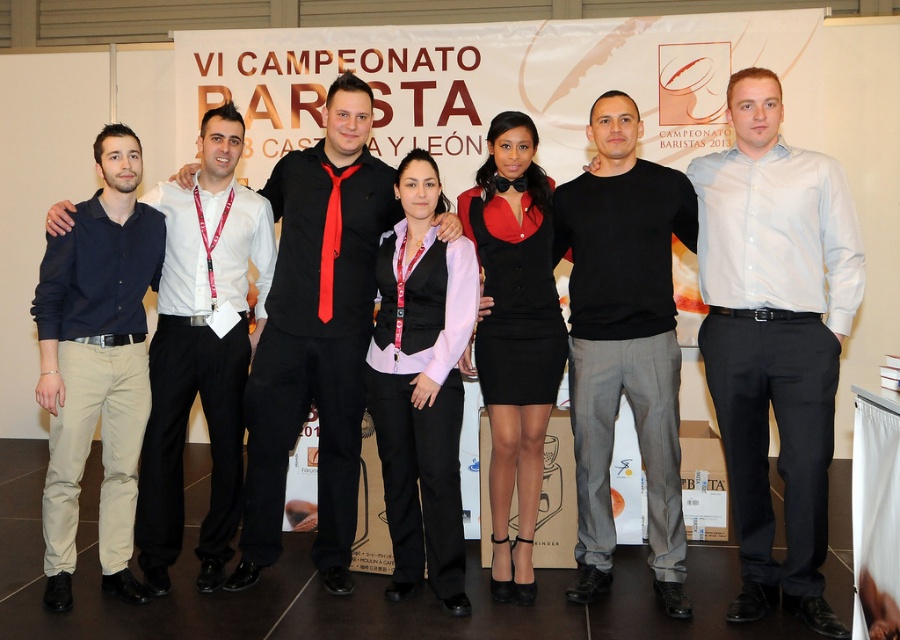
Can you confirm if light blue shirt at center is taller than matte black vest at center?

Indeed, light blue shirt at center has a greater height compared to matte black vest at center.

The width and height of the screenshot is (900, 640). Describe the element at coordinates (775, 339) in the screenshot. I see `light blue shirt at center` at that location.

The width and height of the screenshot is (900, 640). Identify the location of light blue shirt at center. (775, 339).

This screenshot has height=640, width=900. In order to click on light blue shirt at center in this screenshot , I will do `click(775, 339)`.

Can you confirm if black matte shirt at center is positioned to the left of black matte sweater at center?

Indeed, black matte shirt at center is positioned on the left side of black matte sweater at center.

Is black matte shirt at center wider than black matte sweater at center?

Indeed, black matte shirt at center has a greater width compared to black matte sweater at center.

Does point (345, 74) lie behind point (608, 284)?

Yes, point (345, 74) is farther from viewer.

The height and width of the screenshot is (640, 900). Find the location of `black matte shirt at center`. black matte shirt at center is located at coordinates (316, 333).

Can you confirm if light blue shirt at center is positioned below black matte shirt at center?

No.

Does light blue shirt at center have a larger size compared to black matte shirt at center?

Actually, light blue shirt at center might be smaller than black matte shirt at center.

Describe the element at coordinates (775, 339) in the screenshot. I see `light blue shirt at center` at that location.

Locate an element on the screen. This screenshot has height=640, width=900. light blue shirt at center is located at coordinates (775, 339).